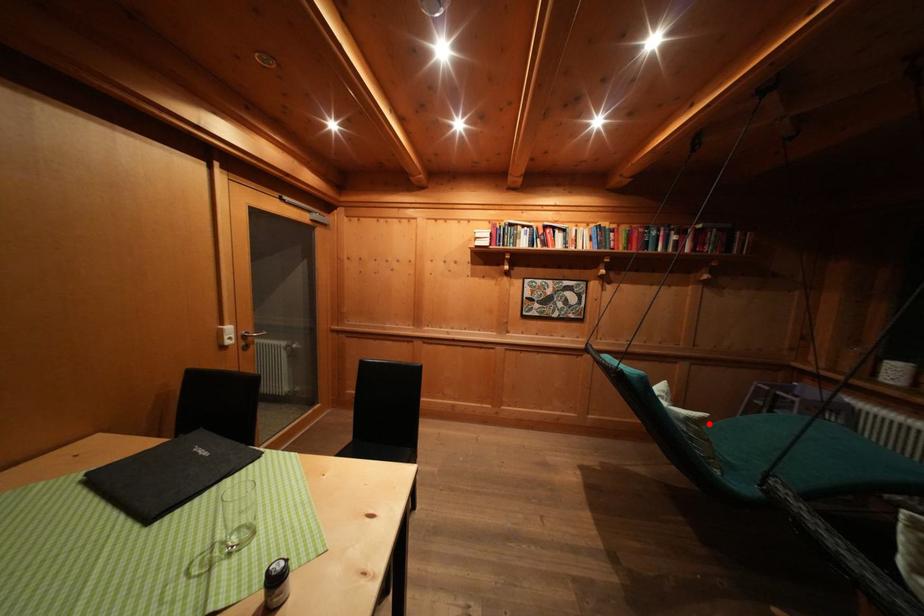
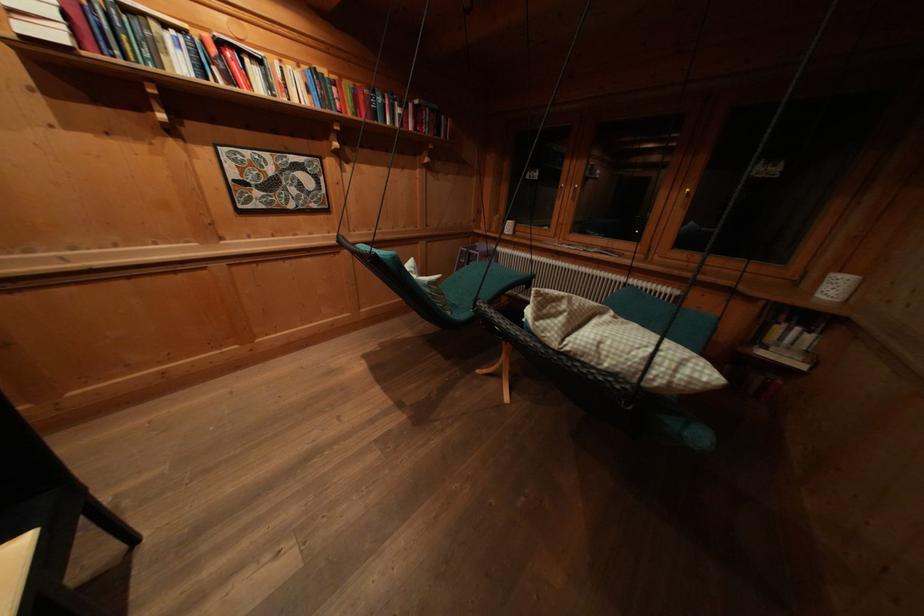
The point at the highlighted location is marked in the first image. Where is the corresponding point in the second image?

(444, 285)